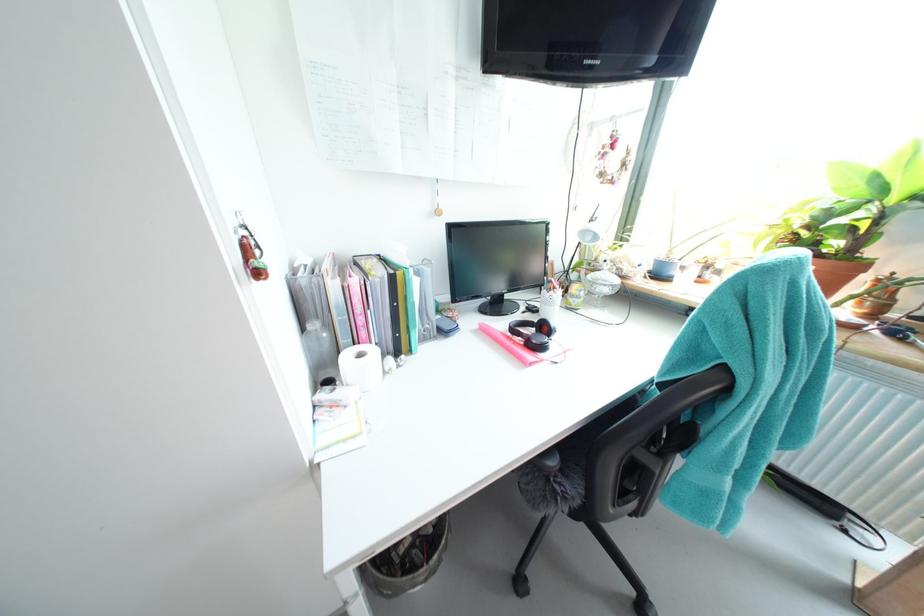
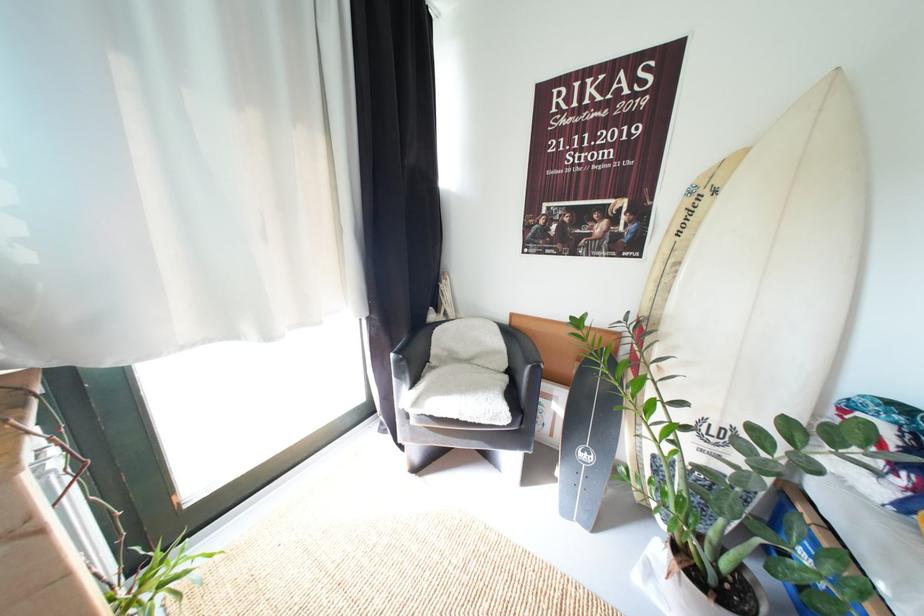
The images are taken continuously from a first-person perspective. In which direction is your viewpoint rotating?

The rotation direction of the camera is right-down.